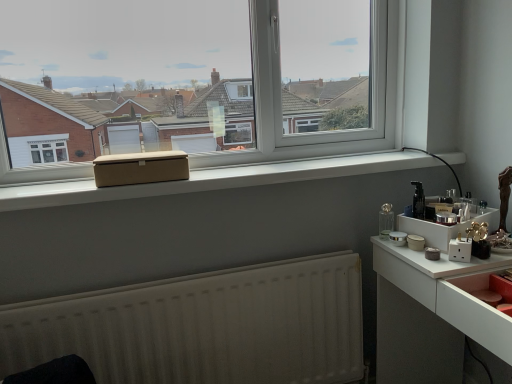
Question: Is black glossy bottle at right smaller than beige fabric box at center?

Choices:
 (A) no
 (B) yes

Answer: (B)

Question: Is black glossy bottle at right to the right of beige fabric box at center from the viewer's perspective?

Choices:
 (A) no
 (B) yes

Answer: (B)

Question: Is black glossy bottle at right further to camera compared to beige fabric box at center?

Choices:
 (A) yes
 (B) no

Answer: (A)

Question: Is black glossy bottle at right beside beige fabric box at center?

Choices:
 (A) no
 (B) yes

Answer: (A)

Question: Is black glossy bottle at right shorter than beige fabric box at center?

Choices:
 (A) no
 (B) yes

Answer: (A)

Question: Does black glossy bottle at right have a greater height compared to beige fabric box at center?

Choices:
 (A) yes
 (B) no

Answer: (A)

Question: Is white plastic tray at right turned away from white matte radiator at lower center?

Choices:
 (A) no
 (B) yes

Answer: (A)

Question: Can you confirm if white plastic tray at right is wider than white matte radiator at lower center?

Choices:
 (A) yes
 (B) no

Answer: (A)

Question: Is white plastic tray at right to the right of white matte radiator at lower center from the viewer's perspective?

Choices:
 (A) yes
 (B) no

Answer: (A)

Question: Is white plastic tray at right smaller than white matte radiator at lower center?

Choices:
 (A) no
 (B) yes

Answer: (B)

Question: From a real-world perspective, is white plastic tray at right beneath white matte radiator at lower center?

Choices:
 (A) yes
 (B) no

Answer: (B)

Question: Is white plastic tray at right shorter than white matte radiator at lower center?

Choices:
 (A) yes
 (B) no

Answer: (A)

Question: From a real-world perspective, is beige fabric box at center physically below matte pink drawer at lower right?

Choices:
 (A) yes
 (B) no

Answer: (B)